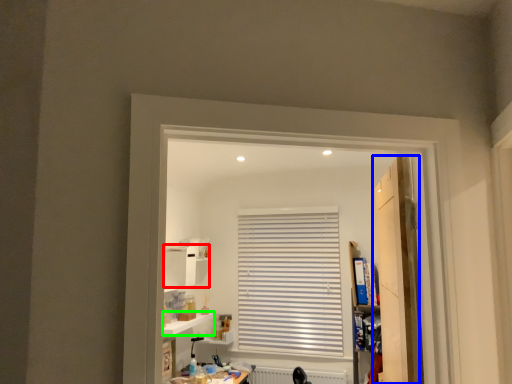
Question: Which object is the closest to the cabinet (highlighted by a red box)? Choose among these: door (highlighted by a blue box) or window sill (highlighted by a green box).

Choices:
 (A) door
 (B) window sill

Answer: (B)